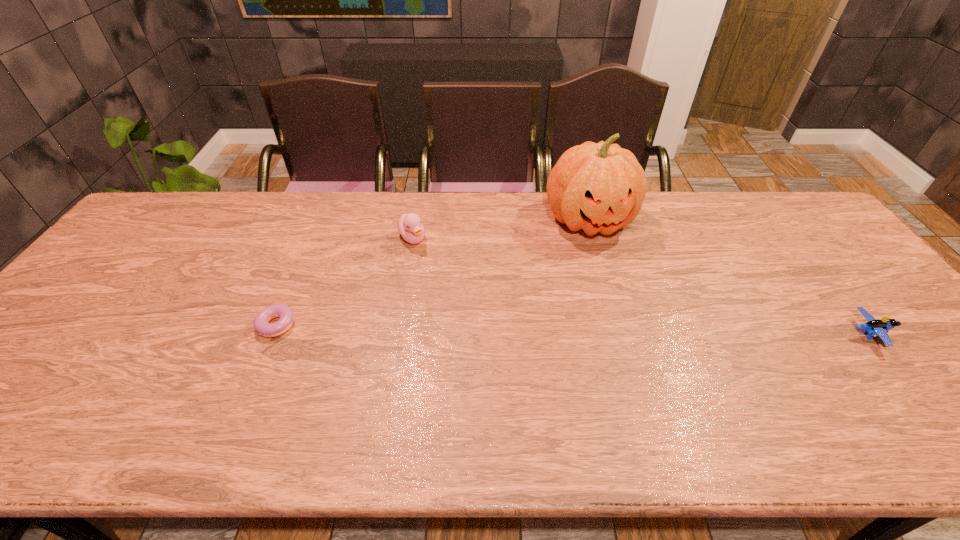
This screenshot has height=540, width=960. Identify the location of vacant space on the desktop that is between the shortest object and the rightmost object and is positioned on the carved face of the second object from right to left. (x=635, y=330).

Identify the location of vacant spot on the desktop that is between the shortest object and the rightmost object and is positioned on the front-facing side of the duckling. (492, 328).